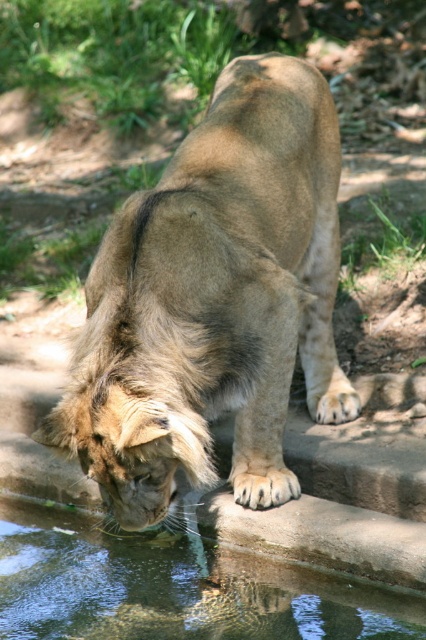
You are a zookeeper observing the golden fur lion at center and the clear water at mouth. Which object has a smaller width when viewed from above?

The golden fur lion at center is thinner than the clear water at mouth, so the golden fur lion at center has a smaller width when viewed from above.

You are a zookeeper observing the golden fur lion at center and the clear water at mouth. Which object is taller?

The golden fur lion at center is much taller than the clear water at mouth.